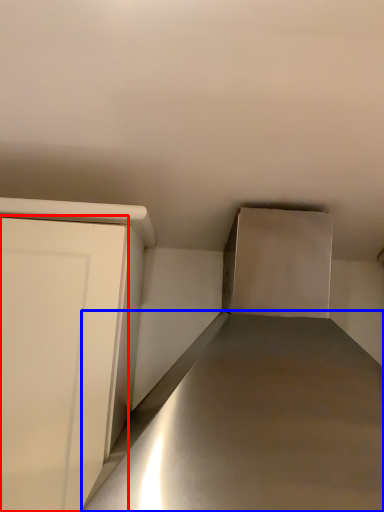
Question: Which object appears closest to the camera in this image, door (highlighted by a red box) or counter top (highlighted by a blue box)?

Choices:
 (A) door
 (B) counter top

Answer: (B)